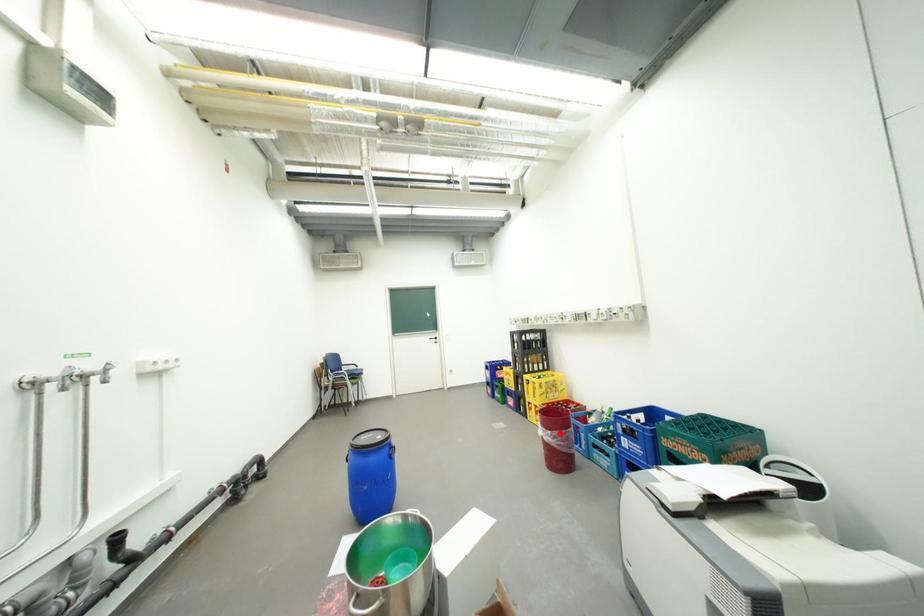
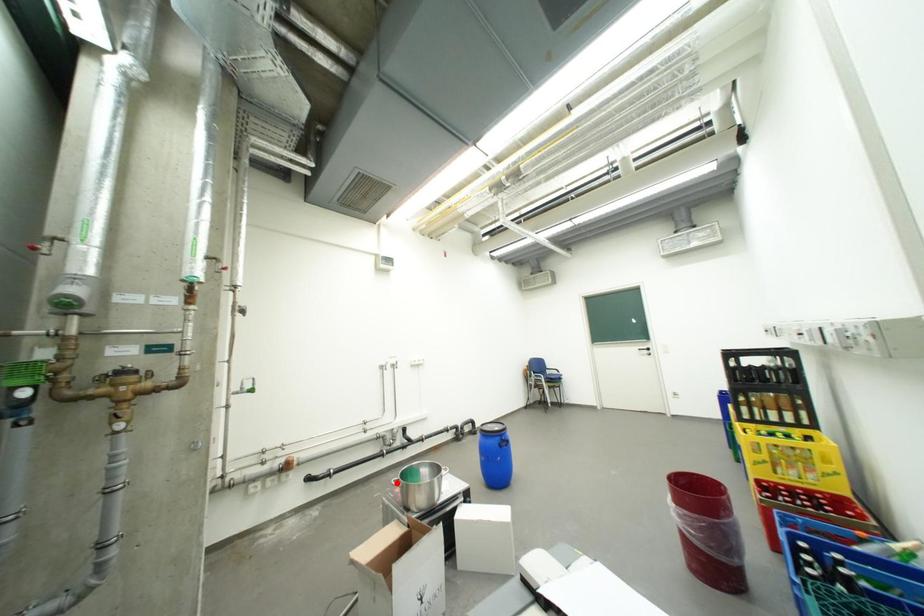
I am providing you with two images of the same scene from different viewpoints. A red point is marked on the first image and another point is marked on the second image. Does the point marked in image1 correspond to the same location as the one in image2?

No